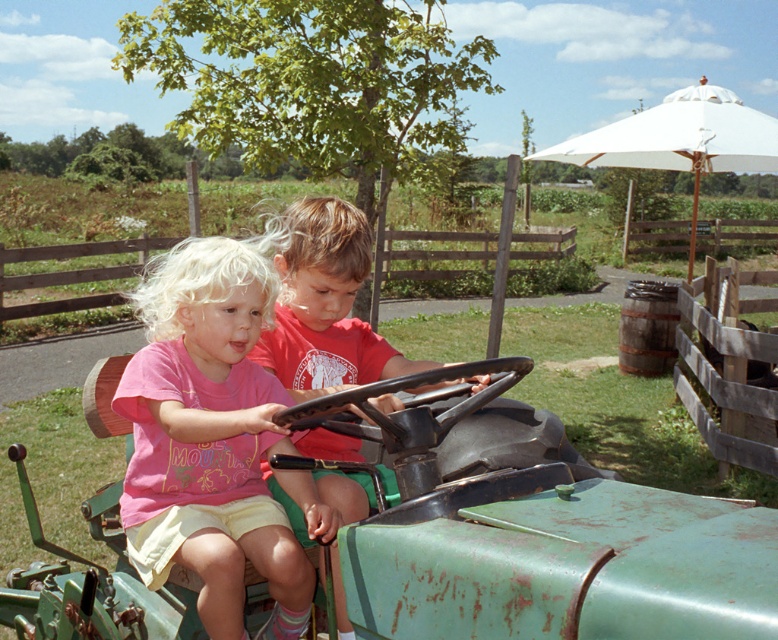
Question: Can you confirm if pink cotton shirt at center is thinner than matte red shirt at center?

Choices:
 (A) yes
 (B) no

Answer: (A)

Question: Which of these objects is positioned farthest from the rusty green tractor at center?

Choices:
 (A) matte red shirt at center
 (B) pink cotton shirt at center

Answer: (A)

Question: Does rusty green tractor at center appear under matte red shirt at center?

Choices:
 (A) yes
 (B) no

Answer: (A)

Question: Estimate the real-world distances between objects in this image. Which object is farther from the matte red shirt at center?

Choices:
 (A) rusty green tractor at center
 (B) pink cotton shirt at center

Answer: (A)

Question: Estimate the real-world distances between objects in this image. Which object is closer to the rusty green tractor at center?

Choices:
 (A) matte red shirt at center
 (B) pink cotton shirt at center

Answer: (B)

Question: Does rusty green tractor at center have a smaller size compared to matte red shirt at center?

Choices:
 (A) no
 (B) yes

Answer: (A)